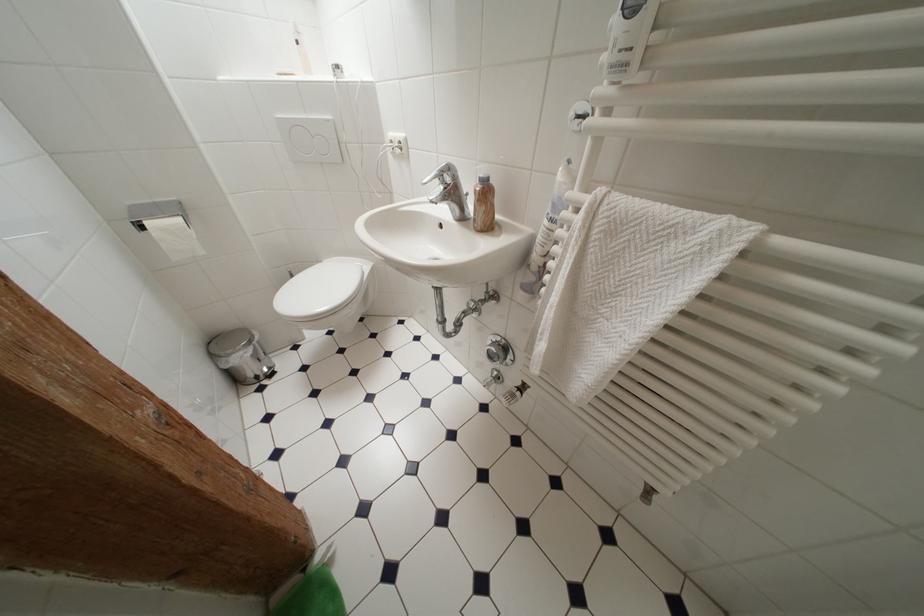
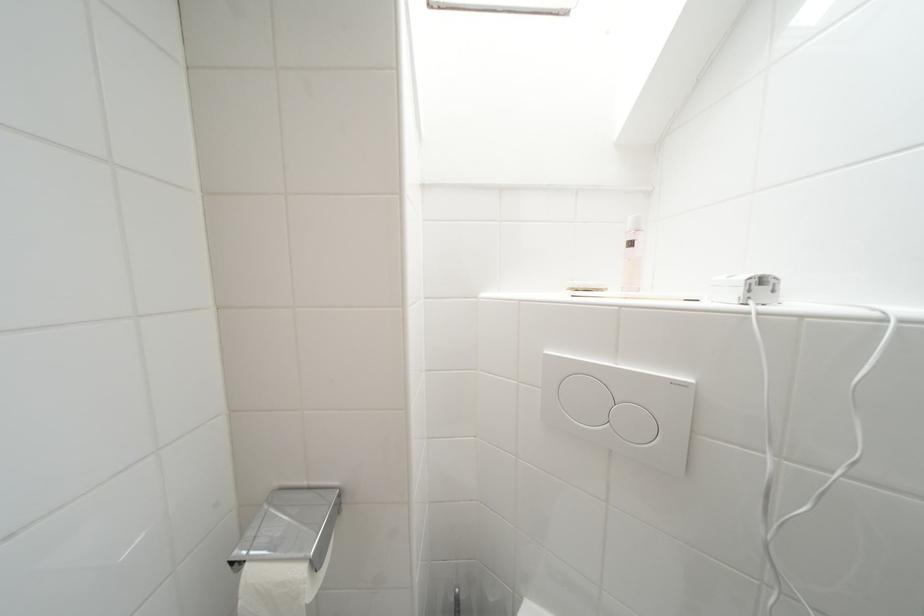
The point at (x=163, y=207) is marked in the first image. Where is the corresponding point in the second image?

(315, 491)